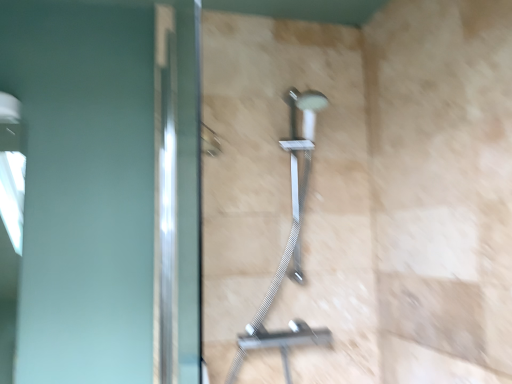
What is the approximate width of satin nickel shower at center?

11.39 inches.

The image size is (512, 384). In order to click on satin nickel shower at center in this screenshot , I will do `click(288, 241)`.

Describe the element at coordinates (288, 241) in the screenshot. I see `satin nickel shower at center` at that location.

Describe the element at coordinates (179, 192) in the screenshot. I see `polished silver screen door at left` at that location.

Locate an element on the screen. This screenshot has height=384, width=512. polished silver screen door at left is located at coordinates (179, 192).

This screenshot has height=384, width=512. I want to click on satin nickel shower at center, so click(288, 241).

Does satin nickel shower at center appear on the left side of polished silver screen door at left?

No, satin nickel shower at center is not to the left of polished silver screen door at left.

Which is behind, satin nickel shower at center or polished silver screen door at left?

satin nickel shower at center is more distant.

Is point (292, 208) less distant than point (189, 121)?

No, (292, 208) is further to viewer.

From the image's perspective, which one is positioned higher, satin nickel shower at center or polished silver screen door at left?

polished silver screen door at left.

From a real-world perspective, is satin nickel shower at center over polished silver screen door at left?

Actually, satin nickel shower at center is physically below polished silver screen door at left in the real world.

Is satin nickel shower at center wider than polished silver screen door at left?

Yes.

From their relative heights in the image, would you say satin nickel shower at center is taller or shorter than polished silver screen door at left?

Clearly, satin nickel shower at center is shorter compared to polished silver screen door at left.

Considering the sizes of objects satin nickel shower at center and polished silver screen door at left in the image provided, who is smaller, satin nickel shower at center or polished silver screen door at left?

With smaller size is polished silver screen door at left.

Consider the image. Is satin nickel shower at center positioned beyond the bounds of polished silver screen door at left?

Indeed, satin nickel shower at center is completely outside polished silver screen door at left.

Can you see satin nickel shower at center touching polished silver screen door at left?

No, satin nickel shower at center is not beside polished silver screen door at left.

Could you tell me if satin nickel shower at center is facing polished silver screen door at left?

No, satin nickel shower at center is not turned towards polished silver screen door at left.

How far apart are satin nickel shower at center and polished silver screen door at left?

They are 12.50 inches apart.

Find the location of a particular element. The width and height of the screenshot is (512, 384). shower below the polished silver screen door at left (from a real-world perspective) is located at coordinates (288, 241).

Which object is positioned more to the right, polished silver screen door at left or satin nickel shower at center?

From the viewer's perspective, satin nickel shower at center appears more on the right side.

Does polished silver screen door at left lie behind satin nickel shower at center?

No, polished silver screen door at left is in front of satin nickel shower at center.

Which is in front, point (192, 357) or point (310, 162)?

Point (192, 357)

From the image's perspective, is polished silver screen door at left over satin nickel shower at center?

Yes, from the image's perspective, polished silver screen door at left is above satin nickel shower at center.

From a real-world perspective, is polished silver screen door at left physically below satin nickel shower at center?

Actually, polished silver screen door at left is physically above satin nickel shower at center in the real world.

Looking at their sizes, would you say polished silver screen door at left is wider or thinner than satin nickel shower at center?

Considering their sizes, polished silver screen door at left looks slimmer than satin nickel shower at center.

Which of these two, polished silver screen door at left or satin nickel shower at center, stands shorter?

satin nickel shower at center.

Is polished silver screen door at left bigger or smaller than satin nickel shower at center?

In the image, polished silver screen door at left appears to be smaller than satin nickel shower at center.

Do you think polished silver screen door at left is within satin nickel shower at center, or outside of it?

polished silver screen door at left cannot be found inside satin nickel shower at center.

Is polished silver screen door at left far from satin nickel shower at center?

No, polished silver screen door at left is in close proximity to satin nickel shower at center.

Is polished silver screen door at left positioned with its back to satin nickel shower at center?

That's right, polished silver screen door at left is facing away from satin nickel shower at center.

This screenshot has height=384, width=512. I want to click on screen door in front of the satin nickel shower at center, so click(x=179, y=192).

You are a GUI agent. You are given a task and a screenshot of the screen. Output one action in this format:
    pyautogui.click(x=<x>, y=<y>)
    Task: Click on the shower behind the polished silver screen door at left
    
    Given the screenshot: What is the action you would take?
    pyautogui.click(x=288, y=241)

Locate an element on the screen. screen door in front of the satin nickel shower at center is located at coordinates (179, 192).